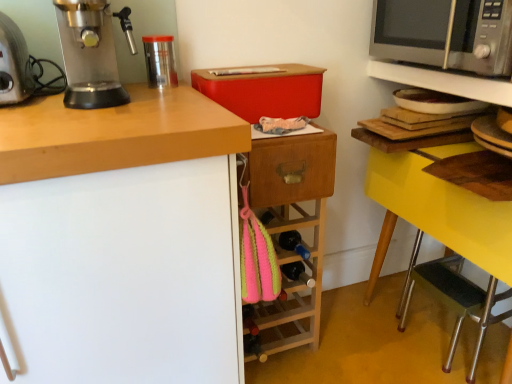
Find the location of a particular element. black rubber step stool at lower right is located at coordinates (454, 300).

What are the coordinates of `silver metallic toaster at left` in the screenshot? It's located at (14, 64).

Measure the distance between silver metallic toaster at left and camera.

silver metallic toaster at left is 35.49 inches from camera.

Measure the distance between point [438,86] and camera.

Point [438,86] is 1.27 meters from camera.

At what (x,y) coordinates should I click in order to perform the action: click on satin silver microwave at upper right. Please return your answer as a coordinate pair (x, y). The height and width of the screenshot is (384, 512). Looking at the image, I should click on (410, 30).

Find the location of a particular element. This screenshot has width=512, height=384. black rubber step stool at lower right is located at coordinates (454, 300).

Between point (266, 154) and point (442, 86), which one is positioned in front?

The point (266, 154) is closer.

Are wooden drawer at center and metallic silver microwave at upper right, which appears as the second shelf when ordered from the bottom, making contact?

No, wooden drawer at center is not making contact with metallic silver microwave at upper right, which appears as the second shelf when ordered from the bottom.

Can you tell me how much wooden drawer at center and metallic silver microwave at upper right, the first shelf viewed from the top, differ in facing direction?

87.9 degrees.

From a real-world perspective, relative to metallic silver microwave at upper right, the first shelf viewed from the top, is wooden drawer at center vertically above or below?

From a real-world perspective, wooden drawer at center is physically below metallic silver microwave at upper right, the first shelf viewed from the top.

From a real-world perspective, relative to yellow wood table at right, acting as the first shelf starting from the bottom, is metallic silver microwave at upper right, which appears as the second shelf when ordered from the bottom, vertically above or below?

From a real-world perspective, metallic silver microwave at upper right, which appears as the second shelf when ordered from the bottom, is physically above yellow wood table at right, acting as the first shelf starting from the bottom.

Considering the relative positions of metallic silver microwave at upper right, the first shelf viewed from the top, and yellow wood table at right, which ranks as the 2th shelf in top-to-bottom order, in the image provided, is metallic silver microwave at upper right, the first shelf viewed from the top, behind yellow wood table at right, which ranks as the 2th shelf in top-to-bottom order,?

Yes, metallic silver microwave at upper right, the first shelf viewed from the top, is further from the viewer.

Are metallic silver microwave at upper right, which appears as the second shelf when ordered from the bottom, and yellow wood table at right, acting as the first shelf starting from the bottom, beside each other?

Yes, metallic silver microwave at upper right, which appears as the second shelf when ordered from the bottom, is next to yellow wood table at right, acting as the first shelf starting from the bottom.

Looking at this image, which is closer to the camera, (474, 76) or (375, 262)?

Point (474, 76) appears to be closer to the viewer than point (375, 262).

Is silver metallic toaster at left positioned behind metallic silver espresso machine at left?

Yes.

From the image's perspective, is silver metallic toaster at left beneath metallic silver espresso machine at left?

Indeed, from the image's perspective, silver metallic toaster at left is shown beneath metallic silver espresso machine at left.

Is silver metallic toaster at left looking in the opposite direction of metallic silver espresso machine at left?

No.

Is yellow wood table at right, acting as the first shelf starting from the bottom, to the right of silver metallic toaster at left from the viewer's perspective?

Yes, yellow wood table at right, acting as the first shelf starting from the bottom, is to the right of silver metallic toaster at left.

Is yellow wood table at right, acting as the first shelf starting from the bottom, spatially inside silver metallic toaster at left, or outside of it?

yellow wood table at right, acting as the first shelf starting from the bottom, is located beyond the bounds of silver metallic toaster at left.

Considering the sizes of objects yellow wood table at right, acting as the first shelf starting from the bottom, and silver metallic toaster at left in the image provided, who is thinner, yellow wood table at right, acting as the first shelf starting from the bottom, or silver metallic toaster at left?

silver metallic toaster at left.

How many degrees apart are the facing directions of yellow wood table at right, which ranks as the 2th shelf in top-to-bottom order, and silver metallic toaster at left?

yellow wood table at right, which ranks as the 2th shelf in top-to-bottom order, and silver metallic toaster at left are facing 90.1 degrees away from each other.

Is black rubber step stool at lower right outside of satin silver microwave at upper right?

Indeed, black rubber step stool at lower right is completely outside satin silver microwave at upper right.

The width and height of the screenshot is (512, 384). Identify the location of microwave oven on the left of black rubber step stool at lower right. (410, 30).

Consider the image. How different are the orientations of black rubber step stool at lower right and satin silver microwave at upper right in degrees?

black rubber step stool at lower right and satin silver microwave at upper right are facing 0.0976 degrees away from each other.

From a real-world perspective, which object stands above the other?

In real-world perspective, satin silver microwave at upper right is above.

Looking at their sizes, would you say silver metallic toaster at left is wider or thinner than wooden drawer at center?

In the image, silver metallic toaster at left appears to be wider than wooden drawer at center.

Relative to wooden drawer at center, is silver metallic toaster at left in front or behind?

silver metallic toaster at left is in front of wooden drawer at center.

From a real-world perspective, which is physically below, silver metallic toaster at left or wooden drawer at center?

From a 3D spatial view, wooden drawer at center is below.

Looking at this image, is silver metallic toaster at left positioned with its back to wooden drawer at center?

No.

Is wooden drawer at center taller than satin silver microwave at upper right?

No.

What's the angular difference between wooden drawer at center and satin silver microwave at upper right's facing directions?

They differ by 87.1 degrees in their facing directions.

Is point (259, 161) closer or farther from the camera than point (503, 3)?

Point (259, 161) is farther from the camera than point (503, 3).

Is wooden drawer at center not near satin silver microwave at upper right?

No, wooden drawer at center is in close proximity to satin silver microwave at upper right.

Identify the location of the 1st shelf counting from the right side of the wooden drawer at center. (444, 81).

Where is `shelf that is under the metallic silver microwave at upper right, which appears as the second shelf when ordered from the bottom (from a real-world perspective)`? The width and height of the screenshot is (512, 384). shelf that is under the metallic silver microwave at upper right, which appears as the second shelf when ordered from the bottom (from a real-world perspective) is located at coordinates (443, 82).

Based on their spatial positions, is satin silver microwave at upper right or yellow wood table at right, which ranks as the 2th shelf in top-to-bottom order, further from metallic silver microwave at upper right, which appears as the second shelf when ordered from the bottom?

satin silver microwave at upper right.

Which object lies nearer to the anchor point metallic silver microwave at upper right, the first shelf viewed from the top, black rubber step stool at lower right or yellow wood table at right, which ranks as the 2th shelf in top-to-bottom order?

yellow wood table at right, which ranks as the 2th shelf in top-to-bottom order, is closer to metallic silver microwave at upper right, the first shelf viewed from the top.

Considering their positions, is metallic silver espresso machine at left positioned further to yellow wood table at right, acting as the first shelf starting from the bottom, than silver metallic toaster at left?

Based on the image, silver metallic toaster at left appears to be further to yellow wood table at right, acting as the first shelf starting from the bottom.

Considering their positions, is satin silver microwave at upper right positioned closer to black rubber step stool at lower right than metallic silver microwave at upper right, the first shelf viewed from the top?

→ metallic silver microwave at upper right, the first shelf viewed from the top, lies closer to black rubber step stool at lower right than the other object.

Consider the image. From the image, which object appears to be farther from black rubber step stool at lower right, metallic silver espresso machine at left or wooden drawer at center?

metallic silver espresso machine at left is further to black rubber step stool at lower right.

Considering their positions, is metallic silver microwave at upper right, which appears as the second shelf when ordered from the bottom, positioned further to metallic silver espresso machine at left than yellow wood table at right, acting as the first shelf starting from the bottom?

metallic silver microwave at upper right, which appears as the second shelf when ordered from the bottom.

Which object lies further to the anchor point satin silver microwave at upper right, metallic silver microwave at upper right, the first shelf viewed from the top, or black rubber step stool at lower right?

The object further to satin silver microwave at upper right is black rubber step stool at lower right.

Which object lies nearer to the anchor point wooden drawer at center, metallic silver espresso machine at left or yellow wood table at right, acting as the first shelf starting from the bottom?

The object closer to wooden drawer at center is yellow wood table at right, acting as the first shelf starting from the bottom.

Image resolution: width=512 pixels, height=384 pixels. Find the location of `drawer between metallic silver espresso machine at left and satin silver microwave at upper right in the horizontal direction`. drawer between metallic silver espresso machine at left and satin silver microwave at upper right in the horizontal direction is located at coordinates (291, 169).

This screenshot has width=512, height=384. I want to click on drawer situated between silver metallic toaster at left and yellow wood table at right, acting as the first shelf starting from the bottom, from left to right, so click(x=291, y=169).

Locate an element on the screen. shelf situated between silver metallic toaster at left and satin silver microwave at upper right from left to right is located at coordinates (444, 81).

Locate an element on the screen. This screenshot has width=512, height=384. microwave oven between metallic silver espresso machine at left and black rubber step stool at lower right in the horizontal direction is located at coordinates (410, 30).